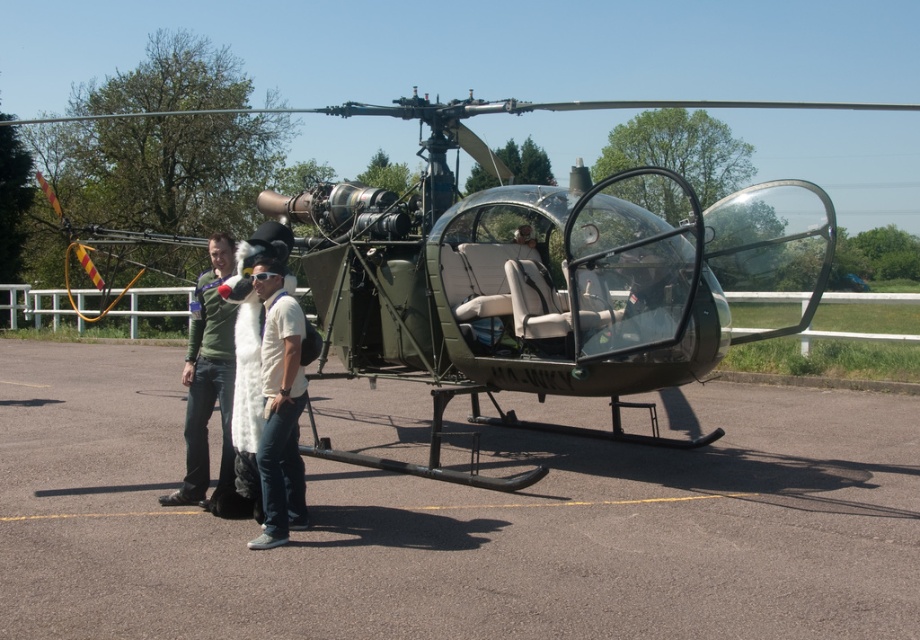
Is point (835, 582) more distant than point (217, 378)?

No.

At what (x,y) coordinates should I click in order to perform the action: click on gray asphalt tarmac at center. Please return your answer as a coordinate pair (x, y). Looking at the image, I should click on (460, 522).

From the picture: Is gray asphalt tarmac at center to the left of green matte helicopter at center from the viewer's perspective?

Indeed, gray asphalt tarmac at center is positioned on the left side of green matte helicopter at center.

Is gray asphalt tarmac at center above green matte helicopter at center?

No, gray asphalt tarmac at center is not above green matte helicopter at center.

In order to click on gray asphalt tarmac at center in this screenshot , I will do `click(460, 522)`.

Does gray asphalt tarmac at center appear on the left side of white fur coat at center?

No, gray asphalt tarmac at center is not to the left of white fur coat at center.

Between gray asphalt tarmac at center and white fur coat at center, which one appears on the right side from the viewer's perspective?

gray asphalt tarmac at center is more to the right.

Does point (170, 621) come closer to viewer compared to point (274, 259)?

Yes, point (170, 621) is closer to viewer.

Identify the location of gray asphalt tarmac at center. This screenshot has width=920, height=640. (460, 522).